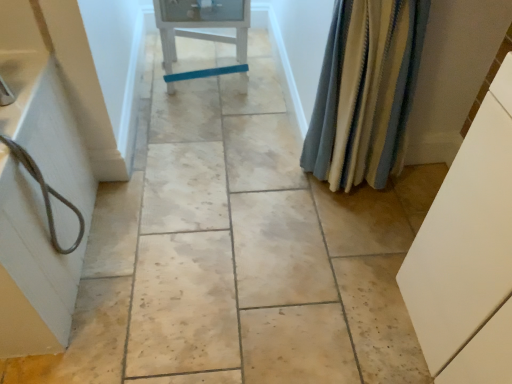
The image size is (512, 384). Find the location of `free point below striped fabric shower curtain at right (from a real-world perspective)`. free point below striped fabric shower curtain at right (from a real-world perspective) is located at coordinates (339, 195).